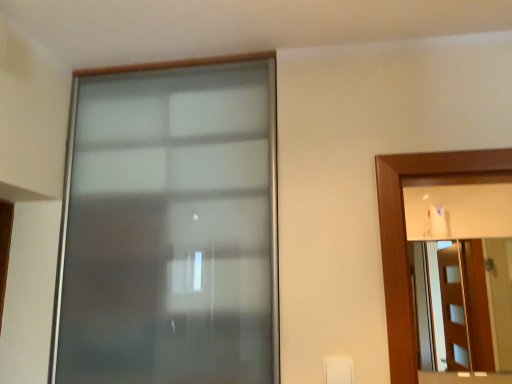
Question: From a real-world perspective, is frosted glass mirror at right positioned over frosted glass window at center based on gravity?

Choices:
 (A) no
 (B) yes

Answer: (A)

Question: Can frosted glass window at center be found inside frosted glass mirror at right?

Choices:
 (A) yes
 (B) no

Answer: (B)

Question: Would you consider frosted glass mirror at right to be distant from frosted glass window at center?

Choices:
 (A) yes
 (B) no

Answer: (A)

Question: Can you confirm if frosted glass mirror at right is shorter than frosted glass window at center?

Choices:
 (A) no
 (B) yes

Answer: (B)

Question: From the image's perspective, does frosted glass mirror at right appear lower than frosted glass window at center?

Choices:
 (A) no
 (B) yes

Answer: (B)

Question: From a real-world perspective, is frosted glass mirror at right beneath frosted glass window at center?

Choices:
 (A) yes
 (B) no

Answer: (A)

Question: Is frosted glass window at center further to camera compared to frosted glass mirror at right?

Choices:
 (A) no
 (B) yes

Answer: (A)

Question: Considering the relative positions of frosted glass window at center and frosted glass mirror at right in the image provided, is frosted glass window at center to the left of frosted glass mirror at right from the viewer's perspective?

Choices:
 (A) no
 (B) yes

Answer: (B)

Question: Can you confirm if frosted glass window at center is shorter than frosted glass mirror at right?

Choices:
 (A) yes
 (B) no

Answer: (B)

Question: Is the surface of frosted glass window at center in direct contact with frosted glass mirror at right?

Choices:
 (A) no
 (B) yes

Answer: (A)

Question: Would you say frosted glass window at center contains frosted glass mirror at right?

Choices:
 (A) yes
 (B) no

Answer: (B)

Question: Is frosted glass window at center positioned in front of frosted glass mirror at right?

Choices:
 (A) no
 (B) yes

Answer: (B)

Question: Would you say frosted glass window at center is to the left or to the right of frosted glass mirror at right in the picture?

Choices:
 (A) left
 (B) right

Answer: (A)